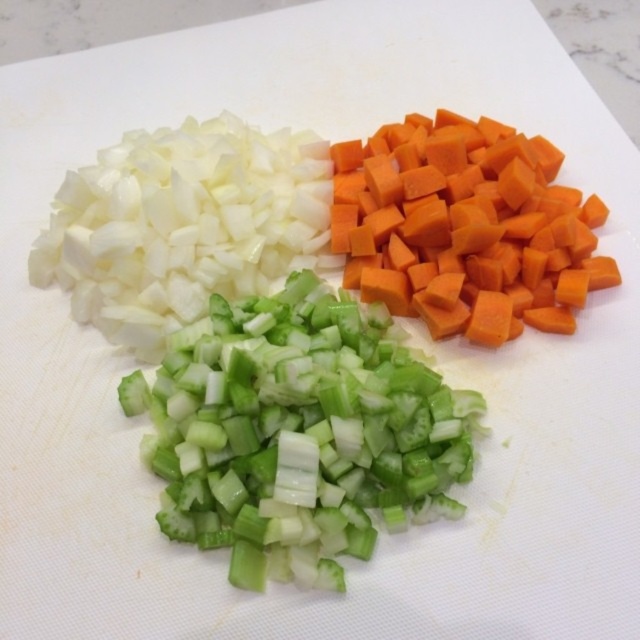
You are preparing a stir fry and need to know which vegetable has a larger width to adjust your cooking time. Which one is wider between the green translucent celery at center and the white matte onion at upper left?

The green translucent celery at center is wider than the white matte onion at upper left according to the description.

You are preparing a vegetable stir fry and need to know the spatial arrangement of the ingredients on the cutting board. Which vegetable is positioned lower than the other between the green translucent celery at center and the orange matte carrot at upper right?

The green translucent celery at center is positioned below the orange matte carrot at upper right.